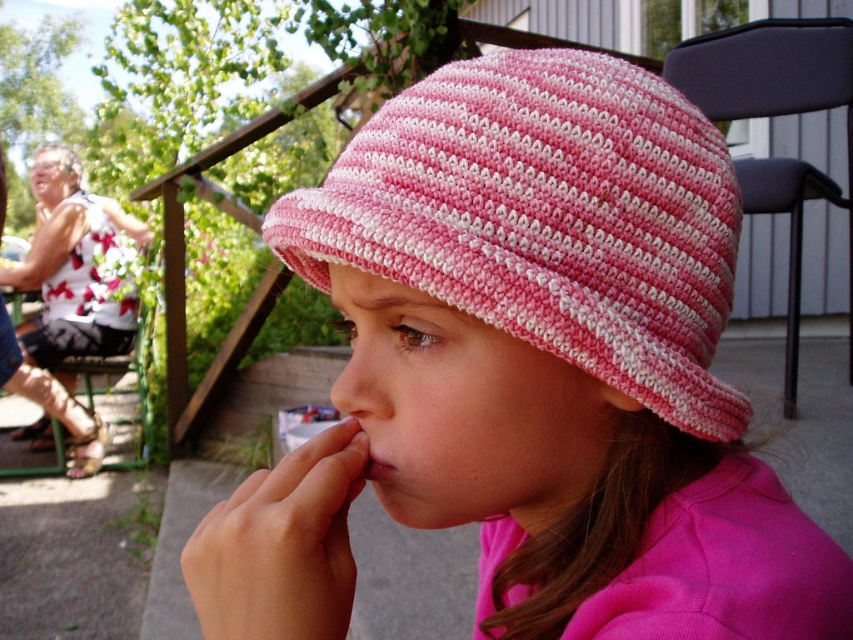
You are taking a photo of the scene and want to focus on both the point at coordinates point (424, 99) and point (489, 108). Which point should you adjust your focus to first to ensure both are in clear view?

You should focus on point (424, 99) first because it is closer to the camera than point (489, 108). By focusing on the closer point, the farther point may also come into focus depending on the depth of field.

You are a photographer trying to capture the girl in the image. You want to focus on her pink knitted nose at center without the pink striped knit hat at center blocking the view. Is this possible given their positions?

The pink striped knit hat at center is closer to the viewer than the pink knitted nose at center, so the hat would block the nose from view. It is not possible to focus on the pink knitted nose at center without the hat blocking it.